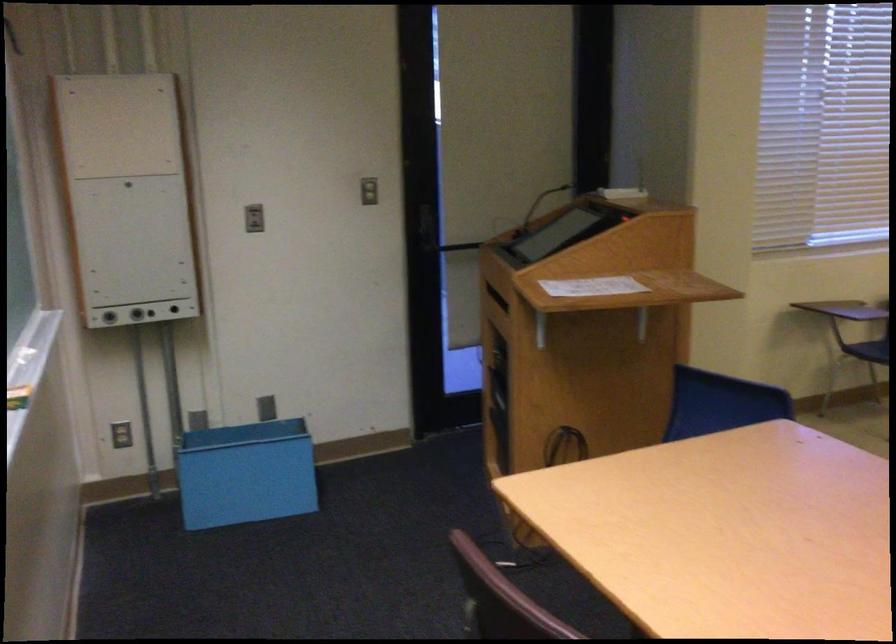
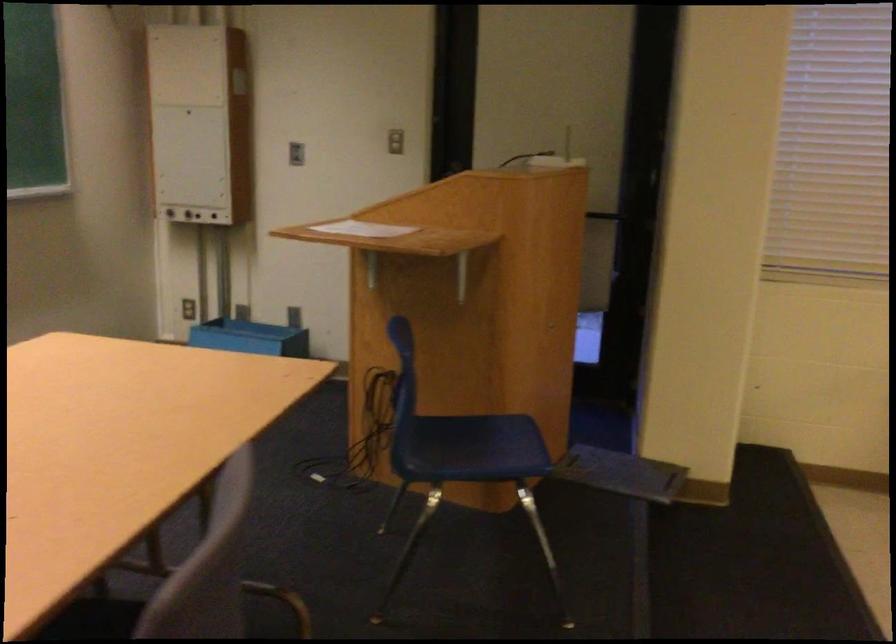
In the second image, find the point that corresponds to point (504, 194) in the first image.

(556, 160)